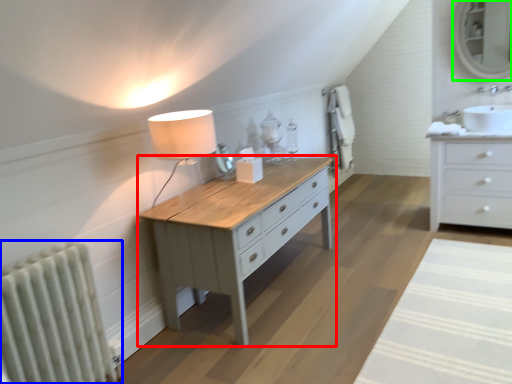
Question: Estimate the real-world distances between objects in this image. Which object is farther from table (highlighted by a red box), radiator (highlighted by a blue box) or mirror (highlighted by a green box)?

Choices:
 (A) radiator
 (B) mirror

Answer: (B)